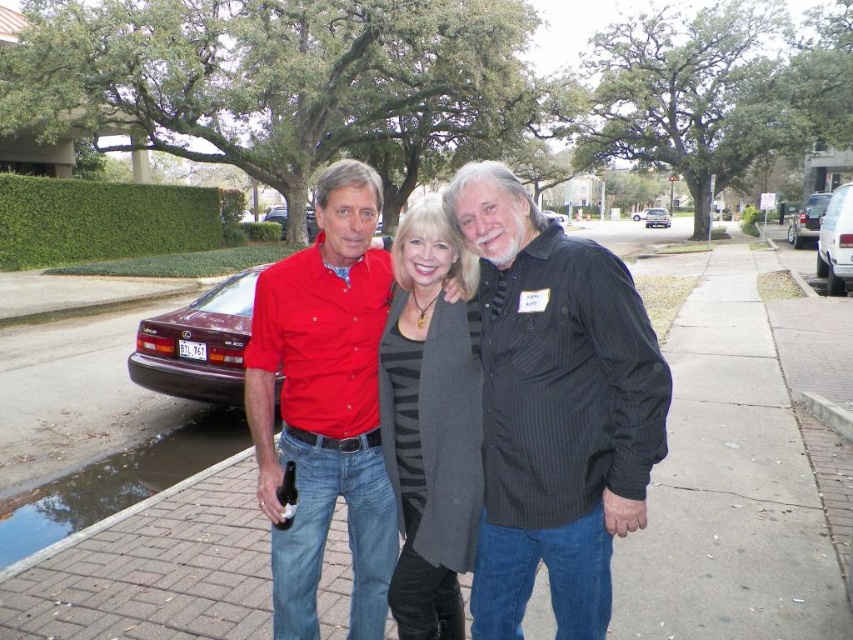
Question: Observing the image, what is the correct spatial positioning of maroon metallic sedan at left in reference to metallic silver sedan at right?

Choices:
 (A) above
 (B) below

Answer: (B)

Question: Can you confirm if brick pavement at center is bigger than maroon metallic sedan at center?

Choices:
 (A) no
 (B) yes

Answer: (B)

Question: Which point is farther to the camera?

Choices:
 (A) (143, 326)
 (B) (845, 228)

Answer: (B)

Question: Among these objects, which one is nearest to the camera?

Choices:
 (A) metallic silver sedan at right
 (B) white glossy van at right

Answer: (B)

Question: Which point is farther from the camera taking this photo?

Choices:
 (A) (489, 332)
 (B) (370, 456)
 (C) (244, 269)
 (D) (834, 189)

Answer: (C)

Question: Can you confirm if black pinstripe shirt at center is bigger than maroon metallic sedan at center?

Choices:
 (A) yes
 (B) no

Answer: (B)